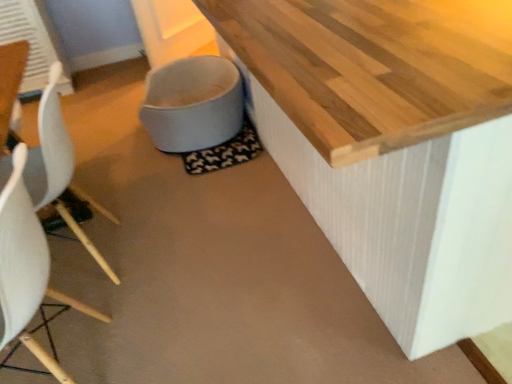
Question: Is point (x=202, y=94) positioned closer to the camera than point (x=56, y=198)?

Choices:
 (A) farther
 (B) closer

Answer: (A)

Question: Considering the positions of white fabric toilet bowl at lower center and white plastic chair at left, the 1th chair in the back-to-front sequence, in the image, is white fabric toilet bowl at lower center wider or thinner than white plastic chair at left, the 1th chair in the back-to-front sequence,?

Choices:
 (A) wide
 (B) thin

Answer: (A)

Question: Which object is positioned closest to the white fabric toilet bowl at lower center?

Choices:
 (A) white plastic chair at left, the 1th chair in the back-to-front sequence
 (B) white matte chair at left, which is counted as the 2th chair, starting from the back

Answer: (A)

Question: Which object is the farthest from the white matte chair at left, which is the first chair in front-to-back order?

Choices:
 (A) white plastic chair at left, the 1th chair in the back-to-front sequence
 (B) white fabric toilet bowl at lower center

Answer: (B)